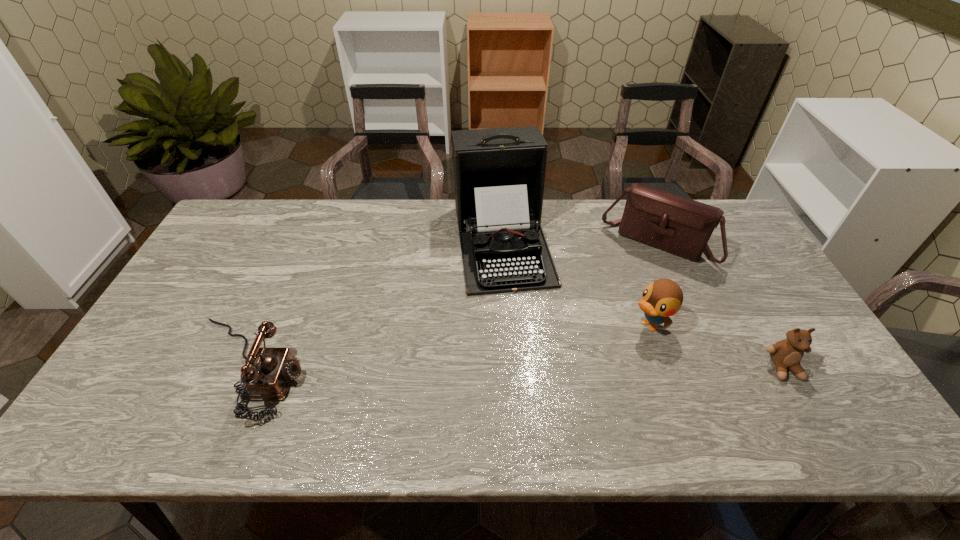
Locate an element on the screen. Image resolution: width=960 pixels, height=540 pixels. free space on the desktop that is between the leftmost object and the teddy bear and is positioned on the front flap of the shoulder bag is located at coordinates (593, 368).

In order to click on free space on the desktop that is between the telephone and the teddy bear and is positioned inside the open case of the typewriter in this screenshot , I will do `click(533, 368)`.

Image resolution: width=960 pixels, height=540 pixels. What are the coordinates of `vacant space on the desktop that is between the telephone and the teddy bear and is positioned on the front-facing side of the duck` in the screenshot? It's located at (573, 368).